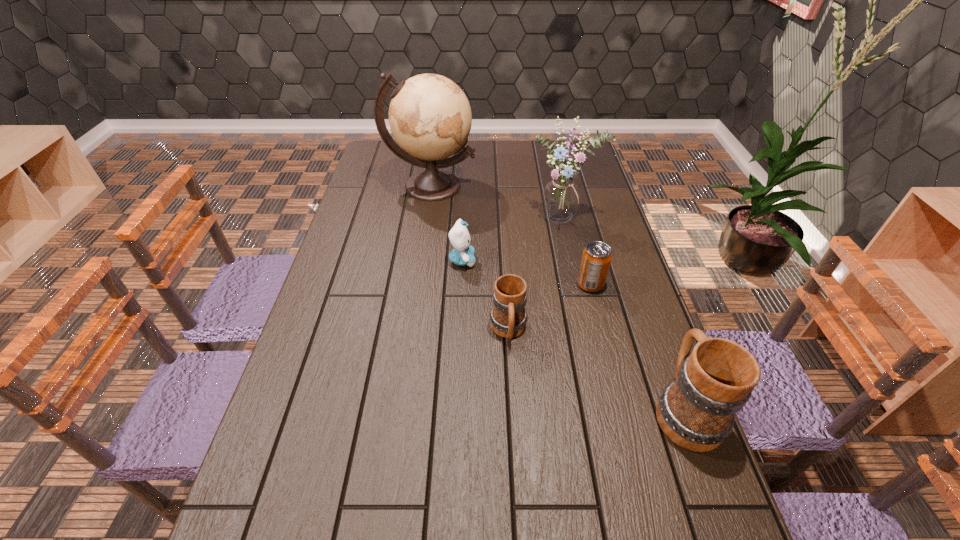
In order to click on soda can situated at the right edge in this screenshot , I will do `click(596, 258)`.

Identify the location of object that is at the far left corner. (430, 118).

Where is `free spot at the far edge of the desktop`? free spot at the far edge of the desktop is located at coordinates (494, 167).

Image resolution: width=960 pixels, height=540 pixels. I want to click on vacant space at the left edge of the desktop, so click(x=361, y=177).

Locate an element on the screen. free space at the right edge of the desktop is located at coordinates (660, 393).

Locate an element on the screen. The height and width of the screenshot is (540, 960). vacant area at the near right corner is located at coordinates (724, 523).

Locate an element on the screen. This screenshot has width=960, height=540. free space between the globe and the kitten is located at coordinates (446, 223).

What are the coordinates of `vacant space that is in between the right mug and the bouquet` in the screenshot? It's located at (624, 314).

This screenshot has width=960, height=540. I want to click on unoccupied area between the bouquet and the taller mug, so click(x=624, y=314).

Locate an element on the screen. vacant area that lies between the farther mug and the fourth shortest object is located at coordinates (596, 370).